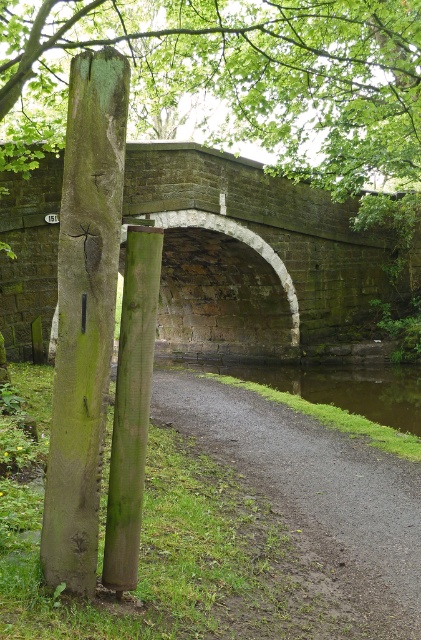
You are a gardener planning to place a new decorative stone statue that is 1.2 meters wide. You see the gray gravel path at lower center and the green mossy wood pole at left. Which location would allow the statue to fit without overlapping either object?

The gray gravel path at lower center is larger in size than the green mossy wood pole at left, so placing the statue on the gray gravel path at lower center would accommodate the 1.2 meter width without overlapping since it has more space available.

You are standing on the grassy bank and see the green mossy wood pole at left and the green mossy post at center. Which one is closer to your left side?

The green mossy wood pole at left is closer to your left side because it is positioned to the left of the green mossy post at center.

You are standing at point (314, 497) in the scene. What is located exactly at this point?

At point (314, 497) lies gray gravel path at lower center.